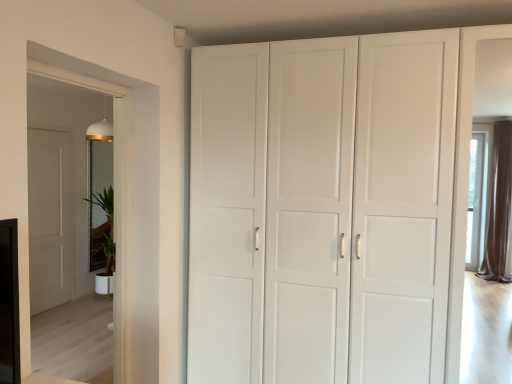
Question: Can you confirm if white glossy plant at left is positioned to the right of white matte cabinet at center?

Choices:
 (A) yes
 (B) no

Answer: (B)

Question: Does white glossy plant at left have a lesser height compared to white matte cabinet at center?

Choices:
 (A) yes
 (B) no

Answer: (A)

Question: From a real-world perspective, is white glossy plant at left below white matte cabinet at center?

Choices:
 (A) no
 (B) yes

Answer: (B)

Question: From a real-world perspective, is white glossy plant at left located higher than white matte cabinet at center?

Choices:
 (A) no
 (B) yes

Answer: (A)

Question: Can you confirm if white glossy plant at left is bigger than white matte cabinet at center?

Choices:
 (A) no
 (B) yes

Answer: (A)

Question: From the image's perspective, is white matte cabinet at center above or below transparent glass door at left?

Choices:
 (A) below
 (B) above

Answer: (A)

Question: Is white matte cabinet at center in front of or behind transparent glass door at left in the image?

Choices:
 (A) behind
 (B) front

Answer: (A)

Question: Considering the positions of white matte cabinet at center and transparent glass door at left in the image, is white matte cabinet at center wider or thinner than transparent glass door at left?

Choices:
 (A) wide
 (B) thin

Answer: (A)

Question: Is point (406, 210) closer or farther from the camera than point (123, 145)?

Choices:
 (A) farther
 (B) closer

Answer: (B)

Question: Based on their positions, is white glossy plant at left located to the left or right of white matte cabinet at center?

Choices:
 (A) right
 (B) left

Answer: (B)

Question: Based on their sizes in the image, would you say white glossy plant at left is bigger or smaller than white matte cabinet at center?

Choices:
 (A) big
 (B) small

Answer: (B)

Question: In terms of width, does white glossy plant at left look wider or thinner when compared to white matte cabinet at center?

Choices:
 (A) wide
 (B) thin

Answer: (B)

Question: Choose the correct answer: Is white glossy plant at left inside white matte cabinet at center or outside it?

Choices:
 (A) inside
 (B) outside

Answer: (B)

Question: In the image, is white glossy plant at left on the left side or the right side of transparent glass door at left?

Choices:
 (A) right
 (B) left

Answer: (B)

Question: In terms of width, does white glossy plant at left look wider or thinner when compared to transparent glass door at left?

Choices:
 (A) thin
 (B) wide

Answer: (B)